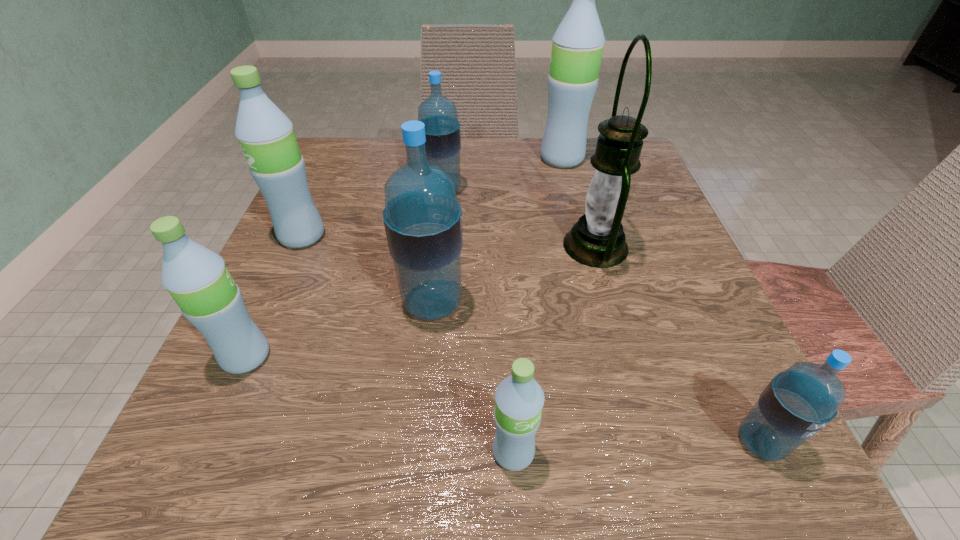
Where is `the second nearest green water bottle`? Image resolution: width=960 pixels, height=540 pixels. the second nearest green water bottle is located at coordinates (197, 278).

You are a GUI agent. You are given a task and a screenshot of the screen. Output one action in this format:
    pyautogui.click(x=<x>, y=<y>)
    Task: Click on the second green water bottle from right to left
    Image resolution: width=960 pixels, height=540 pixels.
    Given the screenshot: What is the action you would take?
    pyautogui.click(x=519, y=399)

Where is `the nearest green water bottle`? The width and height of the screenshot is (960, 540). the nearest green water bottle is located at coordinates (519, 399).

I want to click on the rightmost blue water bottle, so click(799, 402).

I want to click on the rightmost object, so click(x=799, y=402).

In order to click on vacant space located on the front of the biggest green water bottle in this screenshot , I will do `click(570, 191)`.

This screenshot has width=960, height=540. What are the coordinates of `free location located 0.310m on the side where the lantern emits light` in the screenshot? It's located at (392, 246).

Locate an element on the screen. This screenshot has width=960, height=540. blank space located on the side where the lantern emits light is located at coordinates (370, 246).

You are a GUI agent. You are given a task and a screenshot of the screen. Output one action in this format:
    pyautogui.click(x=<x>, y=<y>)
    Task: Click on the free space located 0.170m on the side where the lantern emits light
    
    Given the screenshot: What is the action you would take?
    pyautogui.click(x=469, y=246)

The image size is (960, 540). What are the coordinates of `free space located on the right of the third nearest green water bottle` in the screenshot? It's located at (396, 236).